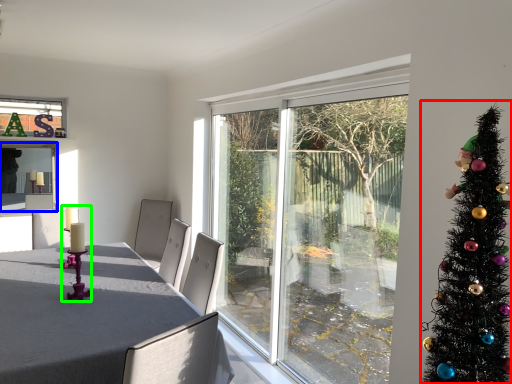
Question: Which object is the farthest from christmas tree (highlighted by a red box)? Choose among these: window screen (highlighted by a blue box) or candle holder (highlighted by a green box).

Choices:
 (A) window screen
 (B) candle holder

Answer: (A)